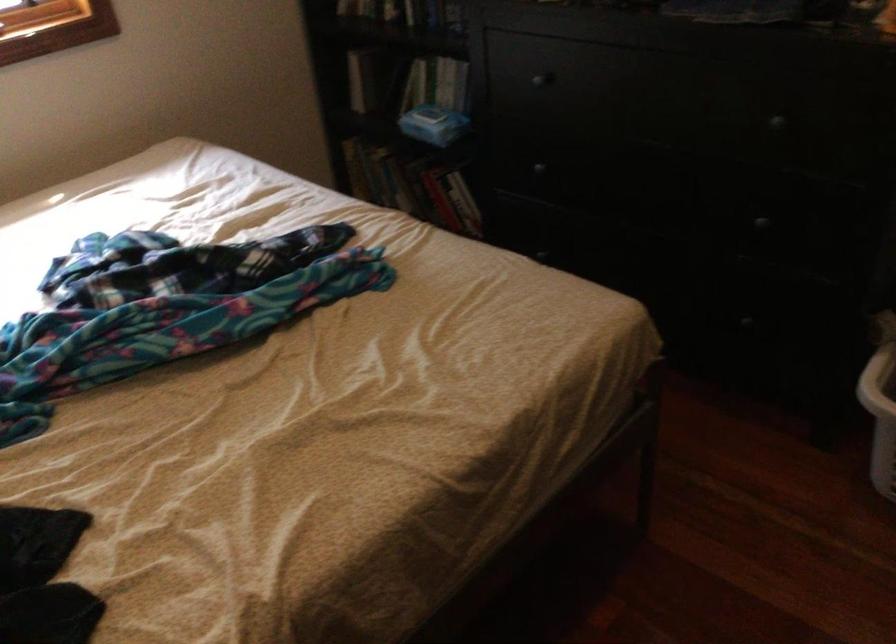
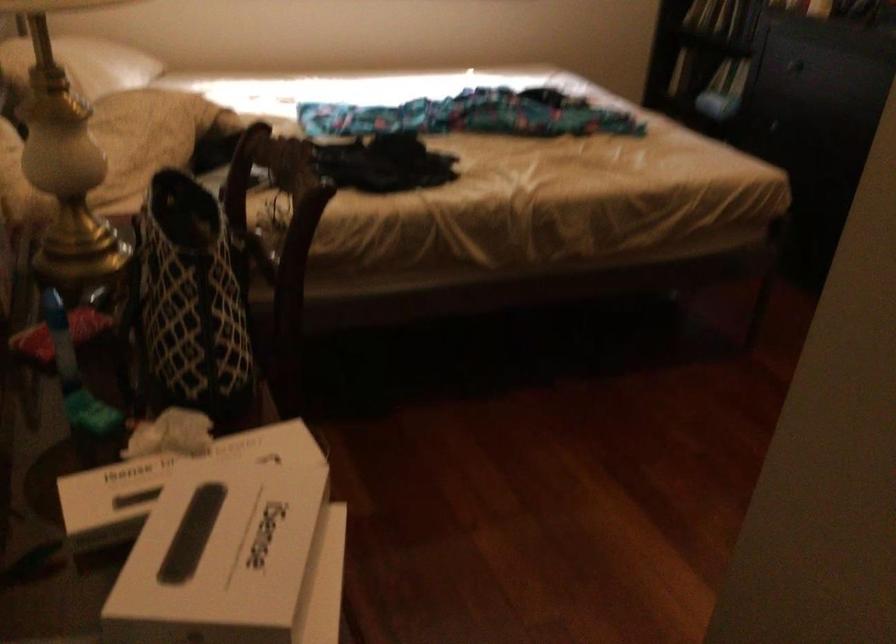
Question: I am providing you with two images of the same scene from different viewpoints. Which of the following objects are not visible in image2?

Choices:
 (A) black tufted cushion
 (B) patterned tote bag
 (C) book
 (D) white pillow

Answer: (C)